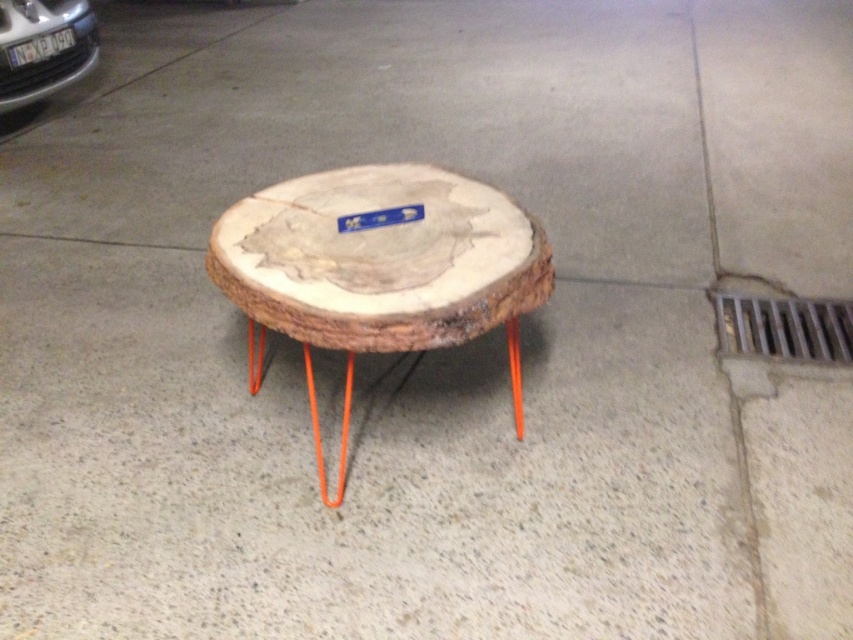
In the scene shown: You are standing at the entrance of the room and want to place a potted plant on the natural wood table at center. Based on the coordinates provided, can you determine if the table is positioned directly in front of you or to the side?

The natural wood table at center is located at point (379, 268), which suggests it is positioned directly in front of you since it is at the center coordinates.